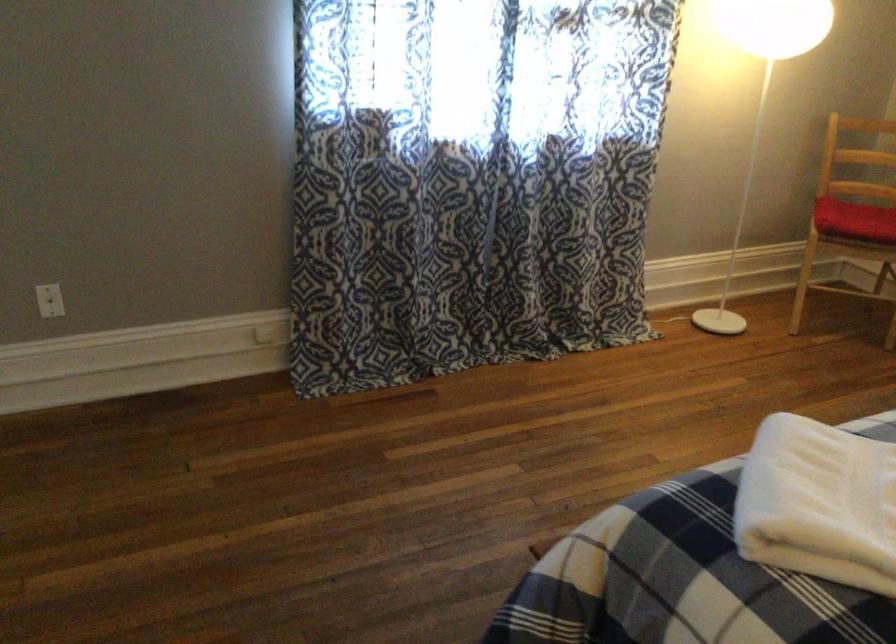
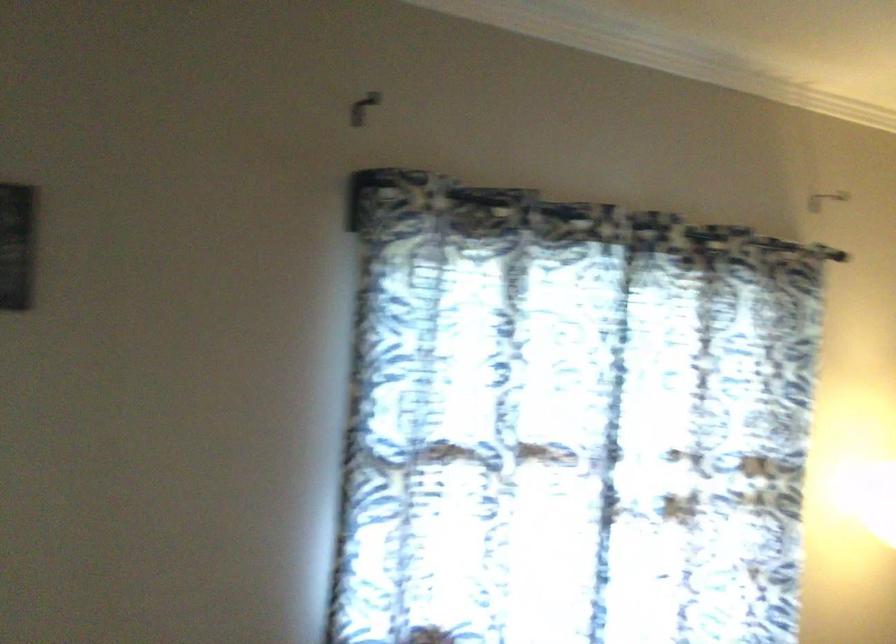
Question: Which direction would the cameraman need to move to produce the second image? Reply with the corresponding letter.

Choices:
 (A) Left
 (B) Right
 (C) Forward
 (D) Backward

Answer: (C)